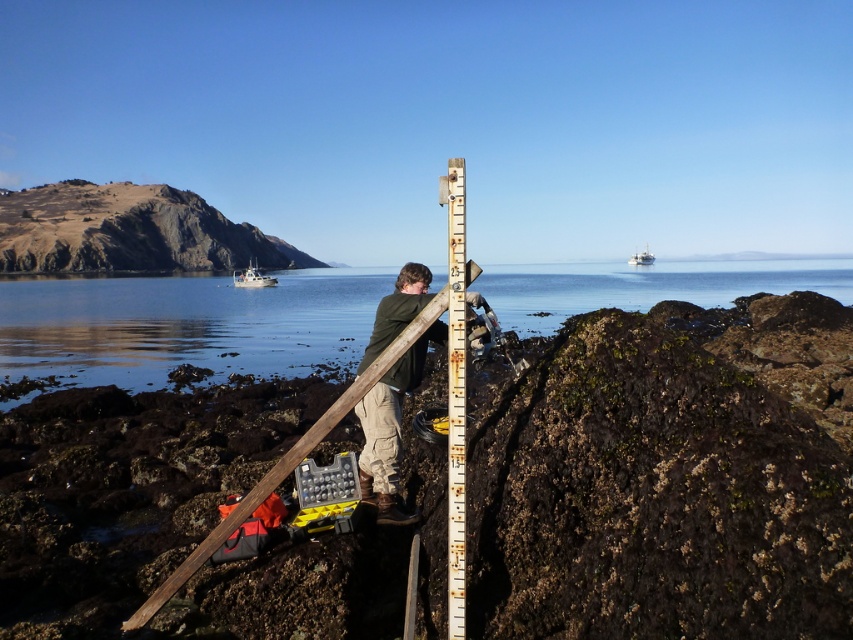
You are a researcher on the rocky shoreline. You need to place a 1.5 meter long equipment box between the clear water at center and the rusty metal ruler at center. Can the equipment box fit between them?

The clear water at center is wider than the rusty metal ruler at center. Therefore, the equipment box of 1.5 meters might not fit if the space between them is narrower than the box. However, since the water is wider, but the exact distance isn not provided, it is uncertain.

You are a marine biologist studying tide pools. You need to place a waterproof sensor in the clear water at center. The sensor must be placed to the left of the rusty metal ruler at center. Can you do this based on the scene?

Yes, the clear water at center is to the right of the rusty metal ruler at center, so placing the sensor in the clear water at center to the left of the rusty metal ruler at center is possible.